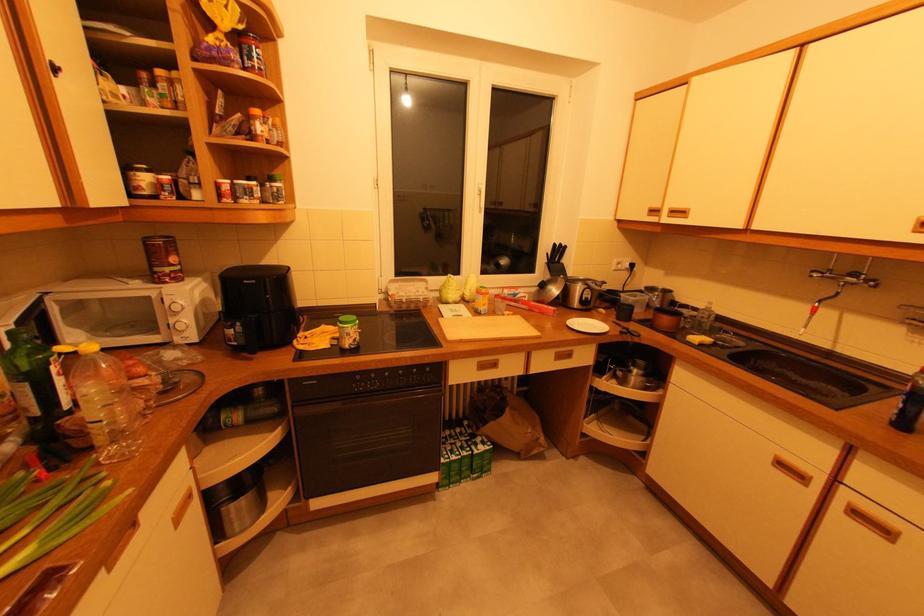
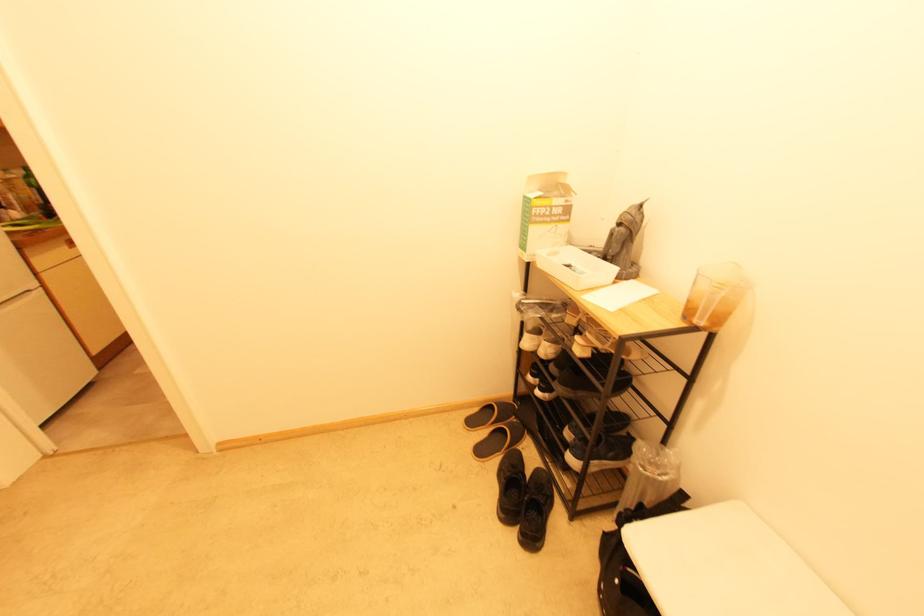
Question: I am providing you with two images of the same scene from different viewpoints. Which of the following objects are not visible in image2?

Choices:
 (A) white shoe
 (B) clear soap dispenser
 (C) wicker hamper
 (D) grey figurine

Answer: (B)